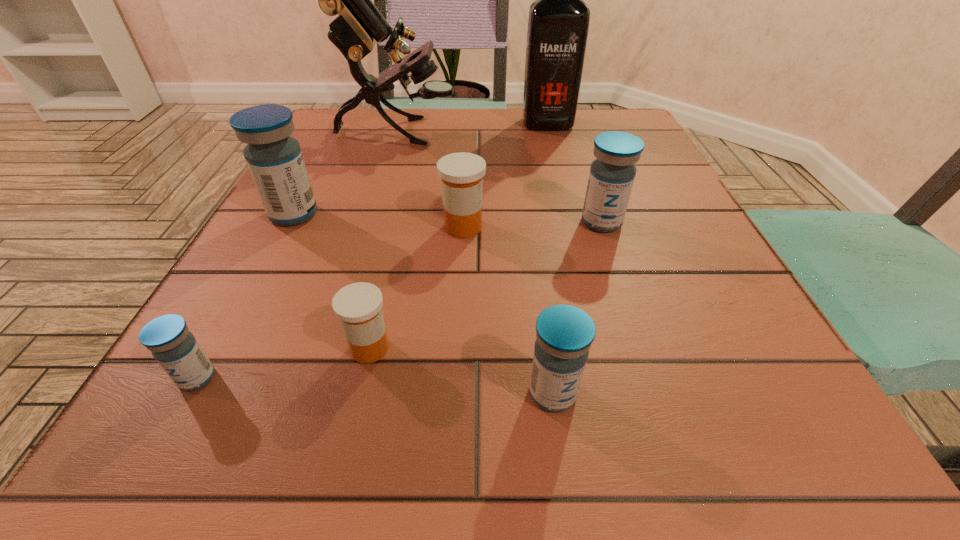
Locate an element on the screen. The image size is (960, 540). black liquor is located at coordinates (558, 23).

I want to click on microscope, so click(359, 25).

Identify the location of the biggest blue medicine. (274, 158).

Locate an element on the screen. Image resolution: width=960 pixels, height=540 pixels. the sixth shortest object is located at coordinates (274, 158).

This screenshot has height=540, width=960. What are the coordinates of `the fifth shortest object` in the screenshot? It's located at (612, 174).

I want to click on the rightmost medicine, so click(612, 174).

In order to click on the right orange medicine in this screenshot , I will do [461, 174].

Locate an element on the screen. the farther orange medicine is located at coordinates (461, 174).

Where is `the third biggest blue medicine`? The height and width of the screenshot is (540, 960). the third biggest blue medicine is located at coordinates (564, 334).

Identify the location of the third blue medicine from left to right. Image resolution: width=960 pixels, height=540 pixels. (564, 334).